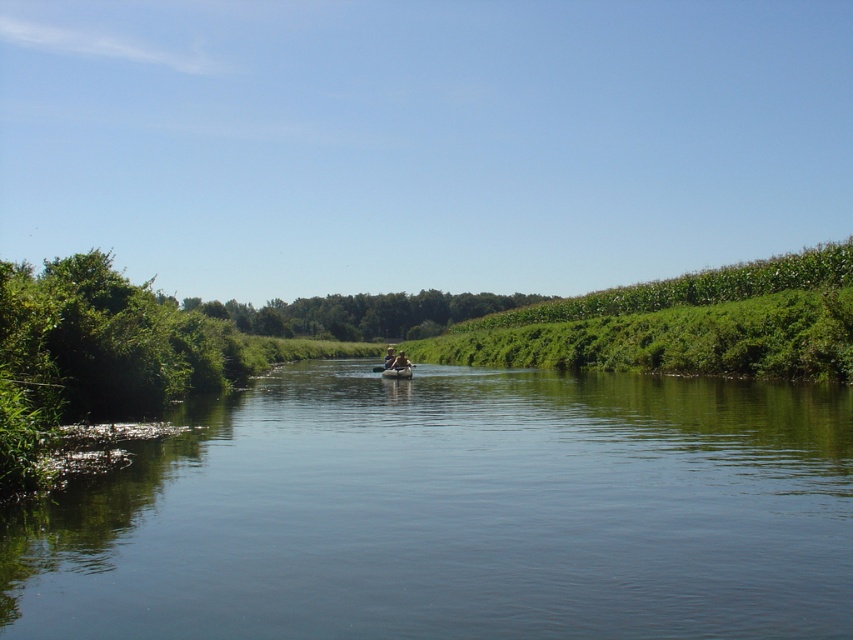
You are planning to take a smooth tan kayak at center for a short trip on the green smooth water at center. Considering their sizes, do you think the kayak will fit comfortably on the water?

The green smooth water at center is larger in size than the smooth tan kayak at center, so the kayak will fit comfortably on the water.

You are standing on the riverbank and see both the smooth tan kayak at center and the light brown wooden paddle boat at center. Which one is positioned to the right side?

The smooth tan kayak at center is positioned to the right of the light brown wooden paddle boat at center.